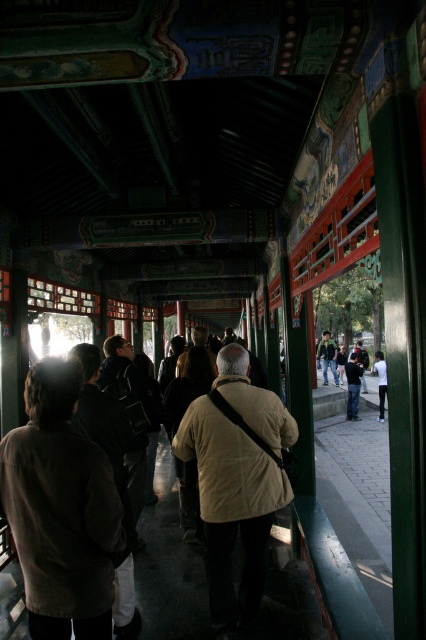
Does point (201, 372) lie behind point (331, 349)?

No, (201, 372) is closer to viewer.

Measure the distance between light beige jacket at center and camera.

light beige jacket at center and camera are 5.69 meters apart.

Is point (196, 480) closer to viewer compared to point (325, 339)?

Yes, it is in front of point (325, 339).

This screenshot has width=426, height=640. In order to click on light beige jacket at center in this screenshot , I will do `click(187, 388)`.

Which is in front, point (175, 465) or point (383, 384)?

Point (175, 465) is in front.

Is light beige jacket at center closer to the viewer compared to white cotton shirt at right?

That is True.

The width and height of the screenshot is (426, 640). What are the coordinates of `light beige jacket at center` in the screenshot? It's located at (187, 388).

Locate an element on the screen. This screenshot has width=426, height=640. light beige jacket at center is located at coordinates (187, 388).

Between green fabric jacket at center and white cotton shirt at right, which one appears on the right side from the viewer's perspective?

white cotton shirt at right is more to the right.

Does green fabric jacket at center appear on the right side of white cotton shirt at right?

Incorrect, green fabric jacket at center is not on the right side of white cotton shirt at right.

Between point (328, 339) and point (377, 381), which one is positioned behind?

Positioned behind is point (328, 339).

This screenshot has height=640, width=426. In order to click on green fabric jacket at center in this screenshot , I will do `click(328, 356)`.